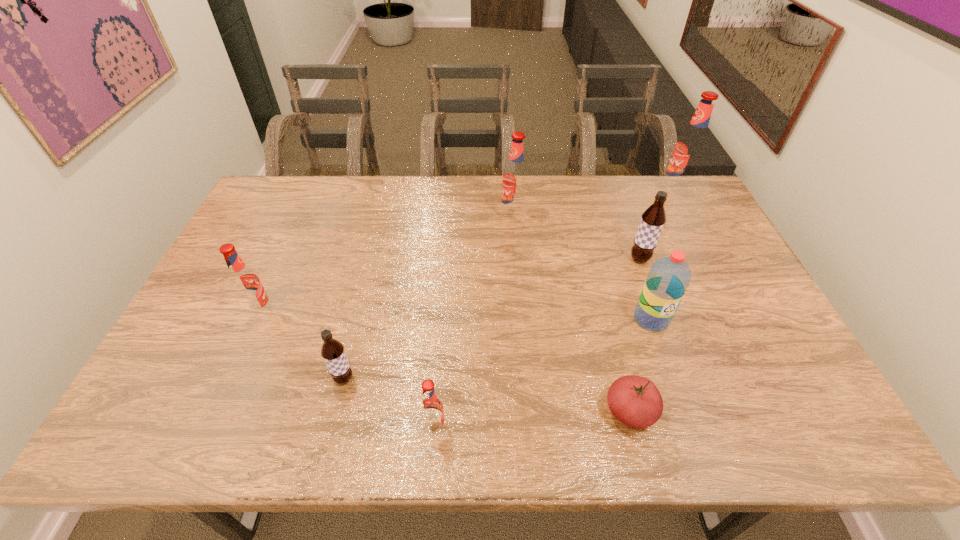
In the image, there is a desktop. Where is `blank space at the left edge`? The height and width of the screenshot is (540, 960). blank space at the left edge is located at coordinates (264, 251).

In the image, there is a desktop. Where is `vacant space at the far left corner`? The height and width of the screenshot is (540, 960). vacant space at the far left corner is located at coordinates (290, 207).

Image resolution: width=960 pixels, height=540 pixels. In the image, there is a desktop. Find the location of `vacant space at the far right corner`. vacant space at the far right corner is located at coordinates (647, 180).

Find the location of a particular element. The image size is (960, 540). free space between the tomato and the leftmost object is located at coordinates (445, 362).

The height and width of the screenshot is (540, 960). I want to click on vacant area that lies between the shortest object and the second farthest red root beer, so click(571, 313).

Locate an element on the screen. The image size is (960, 540). vacant point located between the smaller brown root beer and the red tomato is located at coordinates (487, 395).

Find the location of a particular element. The image size is (960, 540). vacant region between the rightmost root beer and the seventh nearest object is located at coordinates (594, 204).

Image resolution: width=960 pixels, height=540 pixels. In order to click on vacant point located between the smaller brown root beer and the third red root beer from left to right in this screenshot , I will do `click(428, 297)`.

Where is `vacant space in between the nearest red root beer and the left brown root beer`? The width and height of the screenshot is (960, 540). vacant space in between the nearest red root beer and the left brown root beer is located at coordinates (389, 403).

The height and width of the screenshot is (540, 960). What are the coordinates of `empty space between the red water bottle and the smallest red root beer` in the screenshot? It's located at (542, 373).